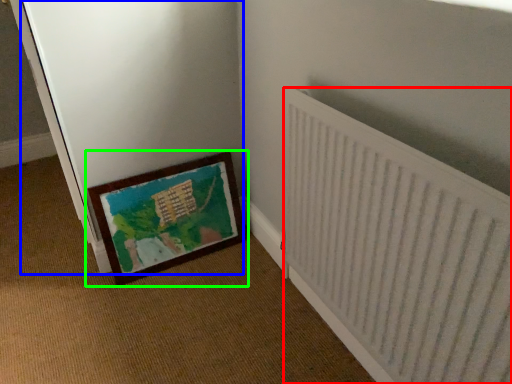
Question: Which is farther away from radiator (highlighted by a red box)? screen door (highlighted by a blue box) or picture frame (highlighted by a green box)?

Choices:
 (A) screen door
 (B) picture frame

Answer: (A)